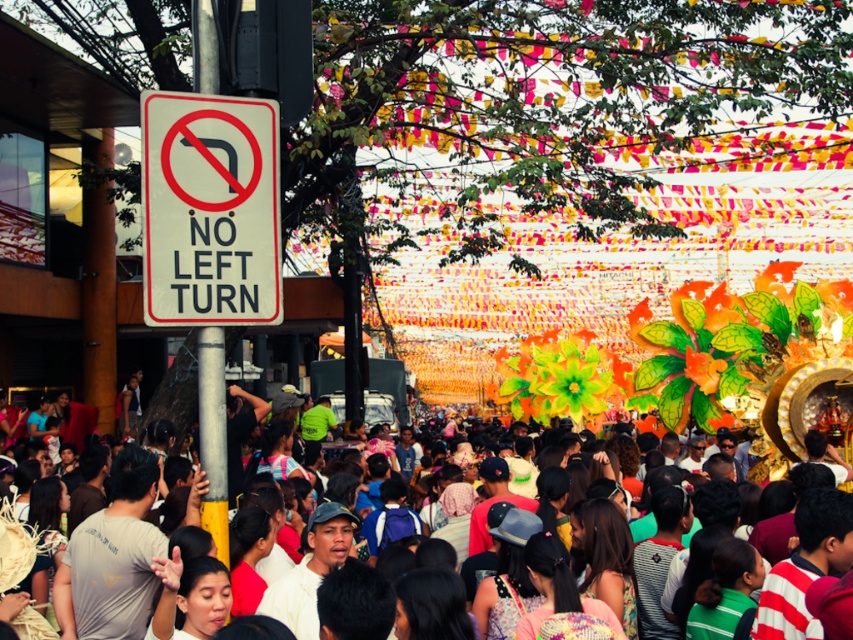
You are a delivery driver who needs to navigate through the street scene. You see the white plastic sign at upper left and the multicolored fabric crowd at center. Which of these two objects takes up more visual space in the image?

The multicolored fabric crowd at center occupies more visual space than the white plastic sign at upper left.

You are a delivery driver who needs to navigate through the street scene shown. You see the white plastic sign at upper left and the multicolored fabric crowd at center. Which object is shorter?

The white plastic sign at upper left is shorter than the multicolored fabric crowd at center.